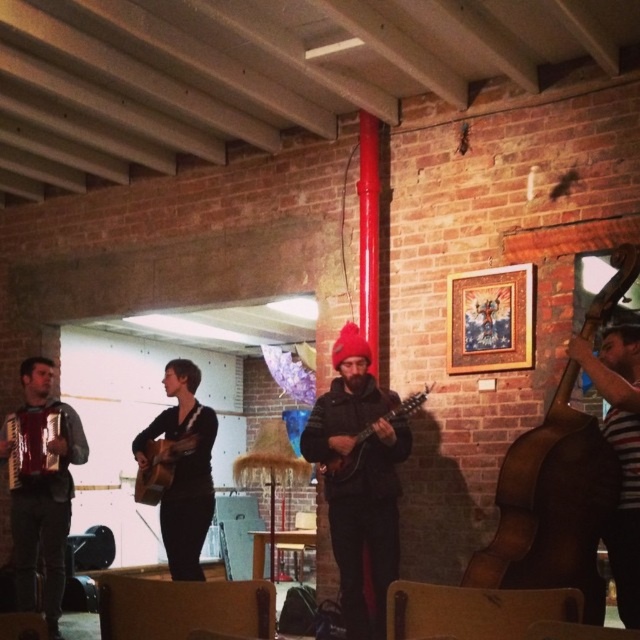
Question: Which of the following is the closest to the observer?

Choices:
 (A) gold-framed painting at upper center
 (B) wooden acoustic guitar at center
 (C) matte brown guitar at center
 (D) black matte guitar at center

Answer: (A)

Question: Where is wooden acoustic guitar at center located in relation to matte black guitar at center in the image?

Choices:
 (A) right
 (B) left

Answer: (B)

Question: Which of the following is the closest to the observer?

Choices:
 (A) (52, 480)
 (B) (605, 353)
 (C) (32, 449)

Answer: (B)

Question: Is gold-framed painting at upper center thinner than matte black guitar at center?

Choices:
 (A) yes
 (B) no

Answer: (A)

Question: Does matte black accordion at left appear on the left side of matte black guitar at center?

Choices:
 (A) no
 (B) yes

Answer: (B)

Question: Which point is farther to the camera?

Choices:
 (A) striped fabric at right
 (B) red knit beanie at center
 (C) gold-framed painting at upper center
 (D) matte brown guitar at center

Answer: (D)